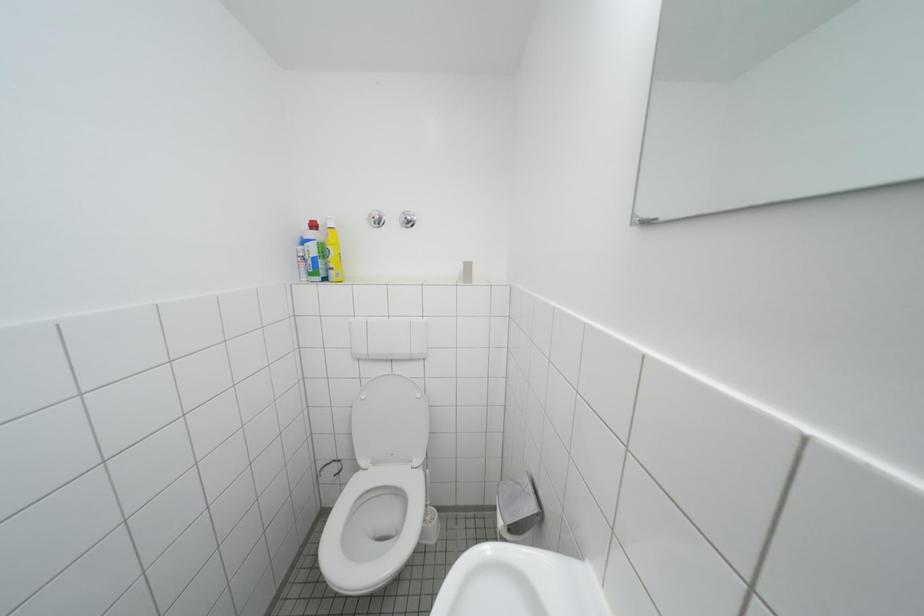
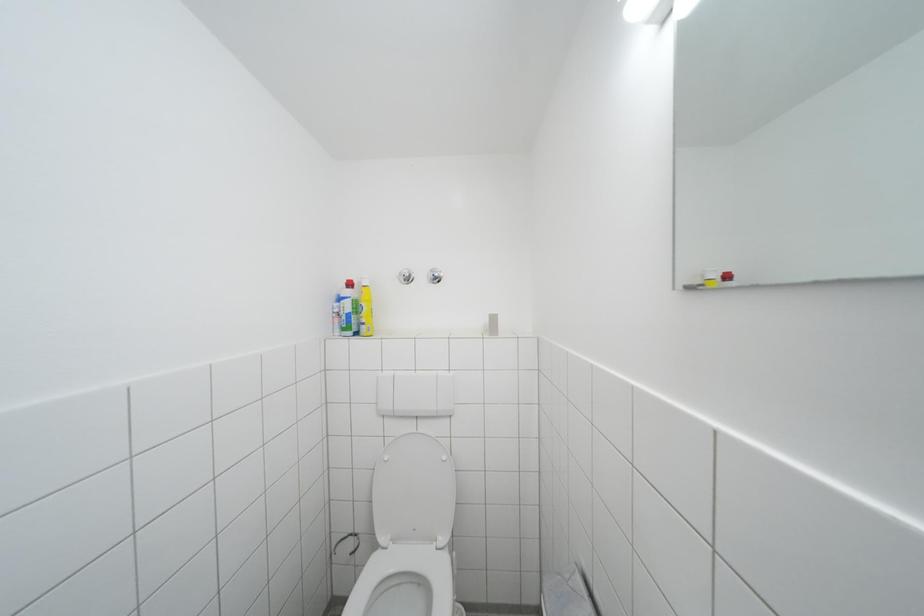
Question: Which direction would the cameraman need to move to produce the second image? Reply with the corresponding letter.

Choices:
 (A) Left
 (B) Right
 (C) Forward
 (D) Backward

Answer: (A)